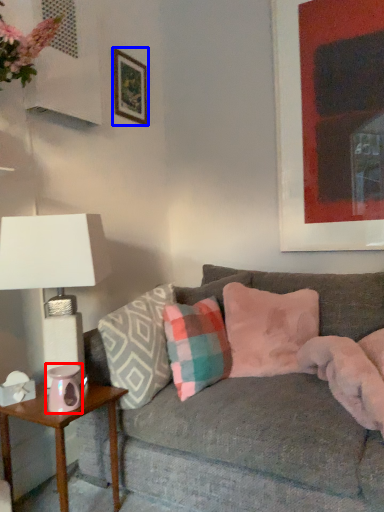
Question: Which object appears closest to the camera in this image, candle holder (highlighted by a red box) or picture frame (highlighted by a blue box)?

Choices:
 (A) candle holder
 (B) picture frame

Answer: (A)